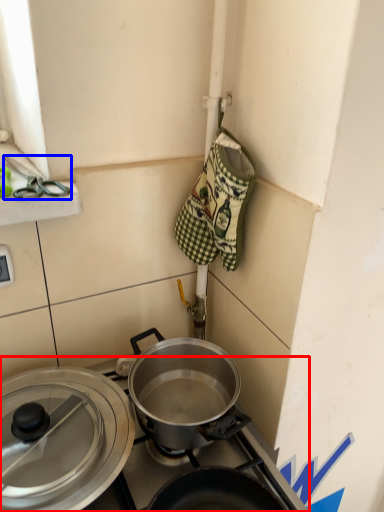
Question: Which object appears closest to the camera in this image, gas stove (highlighted by a red box) or scissors (highlighted by a blue box)?

Choices:
 (A) gas stove
 (B) scissors

Answer: (B)